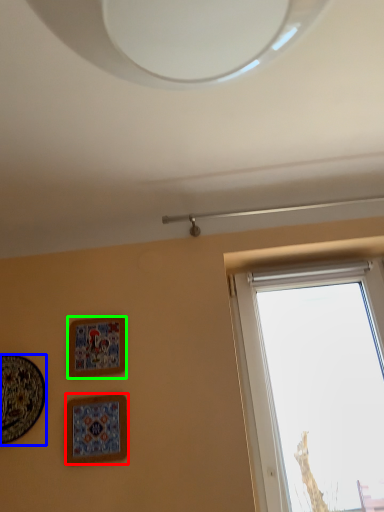
Question: Which object is the farthest from picture frame (highlighted by a red box)? Choose among these: picture frame (highlighted by a blue box) or picture frame (highlighted by a green box).

Choices:
 (A) picture frame
 (B) picture frame

Answer: (A)